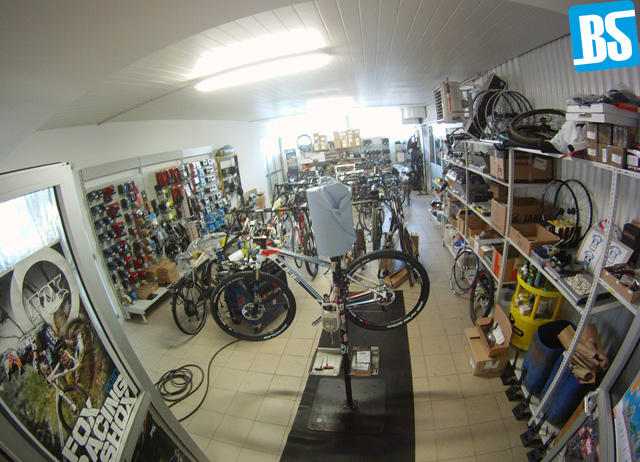
The image size is (640, 462). I want to click on fabric, so click(x=330, y=228).